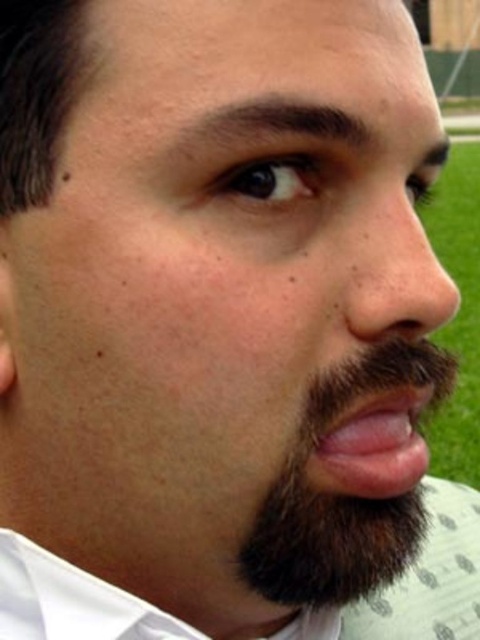
You are a makeup artist preparing to apply foundation to the pink flesh at center. You need to ensure the foundation doesn not get on the brown fuzzy beard at center. Based on the scene description, which facial feature is located lower on the face?

The brown fuzzy beard at center is located below the pink flesh at center, so the beard is lower down on the face.

You are a photographer adjusting your camera focus. You want to capture a clear image of both the brown fuzzy beard at center and the pink flesh at center. Which object should you focus on first to ensure the other remains in acceptable focus?

You should focus on the brown fuzzy beard at center first because it is closer to the viewer than the pink flesh at center. By focusing on the closer object, the depth of field may still keep the pink flesh at center in acceptable focus.